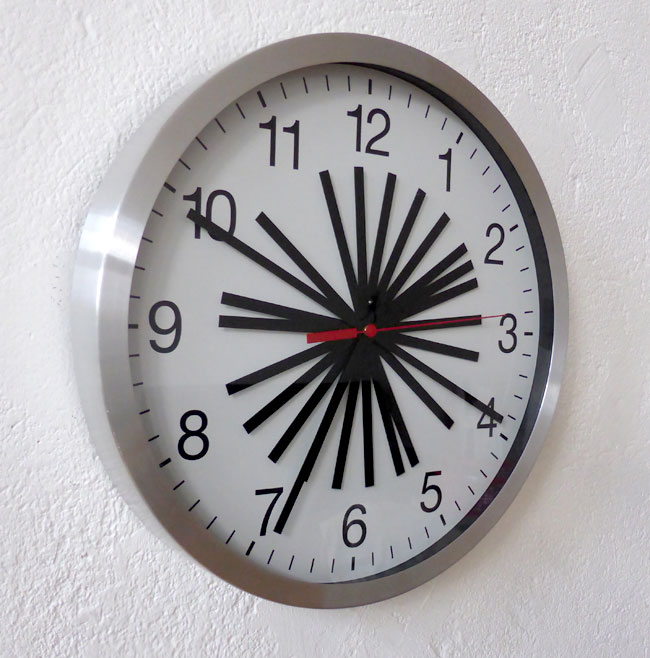
At what (x,y) coordinates should I click in order to perform the action: click on white paint. Please return your answer as a coordinate pair (x, y). Looking at the image, I should click on (398, 651).